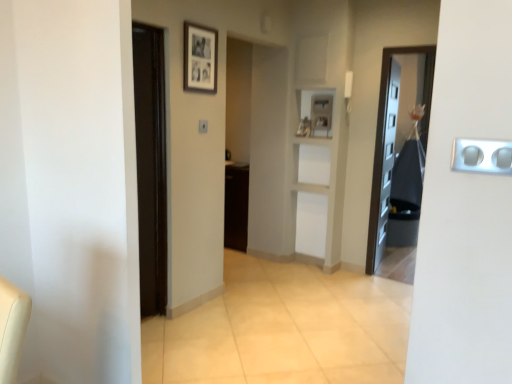
Question: Is black fabric bag at right surrounded by silver metallic outlet at right?

Choices:
 (A) no
 (B) yes

Answer: (A)

Question: Does silver metallic outlet at right turn towards black fabric bag at right?

Choices:
 (A) no
 (B) yes

Answer: (A)

Question: From a real-world perspective, is silver metallic outlet at right physically below black fabric bag at right?

Choices:
 (A) no
 (B) yes

Answer: (A)

Question: From the image's perspective, does silver metallic outlet at right appear higher than black fabric bag at right?

Choices:
 (A) no
 (B) yes

Answer: (A)

Question: Is the depth of silver metallic outlet at right less than that of black fabric bag at right?

Choices:
 (A) no
 (B) yes

Answer: (B)

Question: Do you think silver metallic outlet at right is within black fabric bag at right, or outside of it?

Choices:
 (A) outside
 (B) inside

Answer: (A)

Question: In the image, is silver metallic outlet at right positioned in front of or behind black fabric bag at right?

Choices:
 (A) behind
 (B) front

Answer: (B)

Question: Considering the positions of silver metallic outlet at right and black fabric bag at right in the image, is silver metallic outlet at right wider or thinner than black fabric bag at right?

Choices:
 (A) thin
 (B) wide

Answer: (A)

Question: Is point (508, 144) positioned closer to the camera than point (381, 177)?

Choices:
 (A) closer
 (B) farther

Answer: (A)

Question: Would you say silver metallic outlet at right is inside or outside black matte picture frame at upper center?

Choices:
 (A) outside
 (B) inside

Answer: (A)

Question: Considering the positions of silver metallic outlet at right and black matte picture frame at upper center in the image, is silver metallic outlet at right taller or shorter than black matte picture frame at upper center?

Choices:
 (A) short
 (B) tall

Answer: (A)

Question: In terms of width, does silver metallic outlet at right look wider or thinner when compared to black matte picture frame at upper center?

Choices:
 (A) wide
 (B) thin

Answer: (B)

Question: Considering their positions, is silver metallic outlet at right located in front of or behind black matte picture frame at upper center?

Choices:
 (A) behind
 (B) front

Answer: (B)

Question: Looking at the image, does black fabric bag at right seem bigger or smaller compared to white plastic light switch at center?

Choices:
 (A) big
 (B) small

Answer: (A)

Question: Based on their positions, is black fabric bag at right located to the left or right of white plastic light switch at center?

Choices:
 (A) left
 (B) right

Answer: (B)